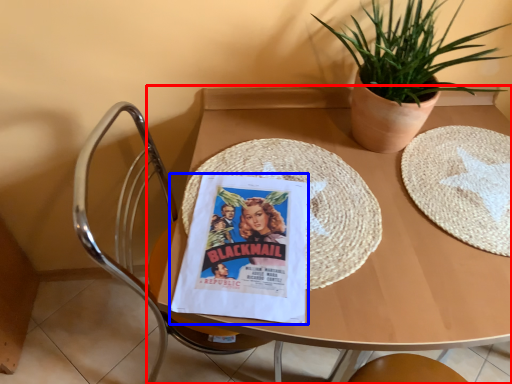
Question: Which point is further to the camera, table (highlighted by a red box) or comic book (highlighted by a blue box)?

Choices:
 (A) table
 (B) comic book

Answer: (B)